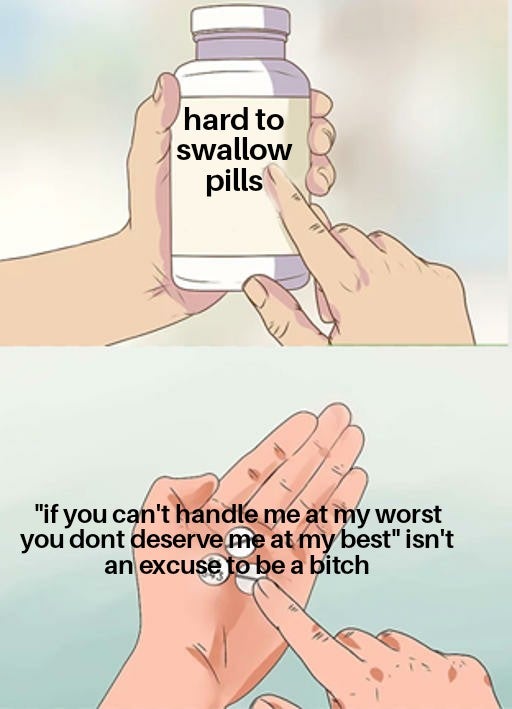
Locate an element on the screen. This screenshot has width=512, height=709. bottle is located at coordinates (229, 255).